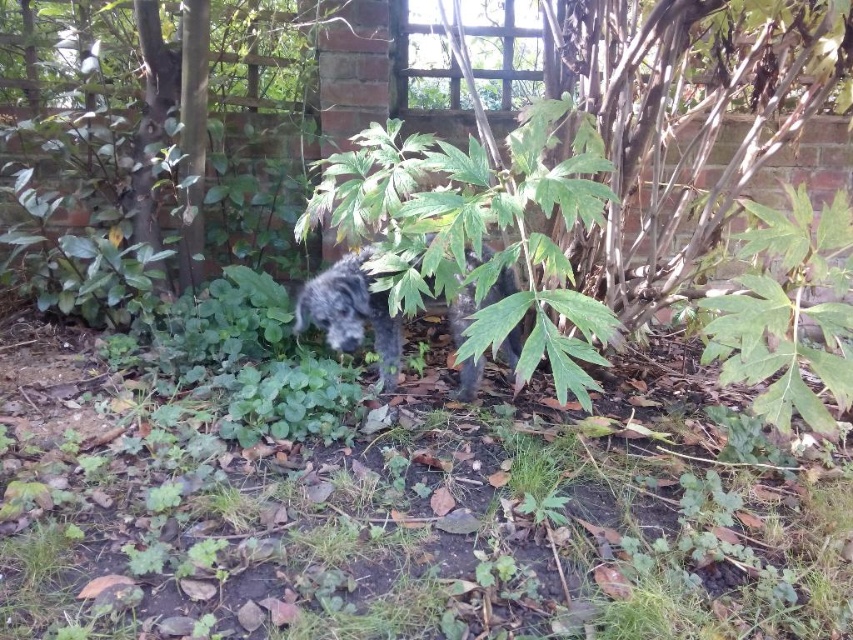
Question: Among these objects, which one is farthest from the camera?

Choices:
 (A) shaggy gray dog at center
 (B) green leafy plant at center right
 (C) green leafy plant at center
 (D) fuzzy black dog at center

Answer: (D)

Question: Does shaggy gray dog at center appear on the right side of fuzzy black dog at center?

Choices:
 (A) yes
 (B) no

Answer: (A)

Question: Which object is positioned closest to the fuzzy black dog at center?

Choices:
 (A) green leafy plant at center
 (B) green leafy plant at center right

Answer: (A)

Question: Among these objects, which one is farthest from the camera?

Choices:
 (A) green leafy plant at center
 (B) green leafy plant at center right

Answer: (B)

Question: Does green leafy plant at center right have a lesser width compared to fuzzy black dog at center?

Choices:
 (A) no
 (B) yes

Answer: (A)

Question: Is green leafy plant at center right smaller than fuzzy black dog at center?

Choices:
 (A) yes
 (B) no

Answer: (B)